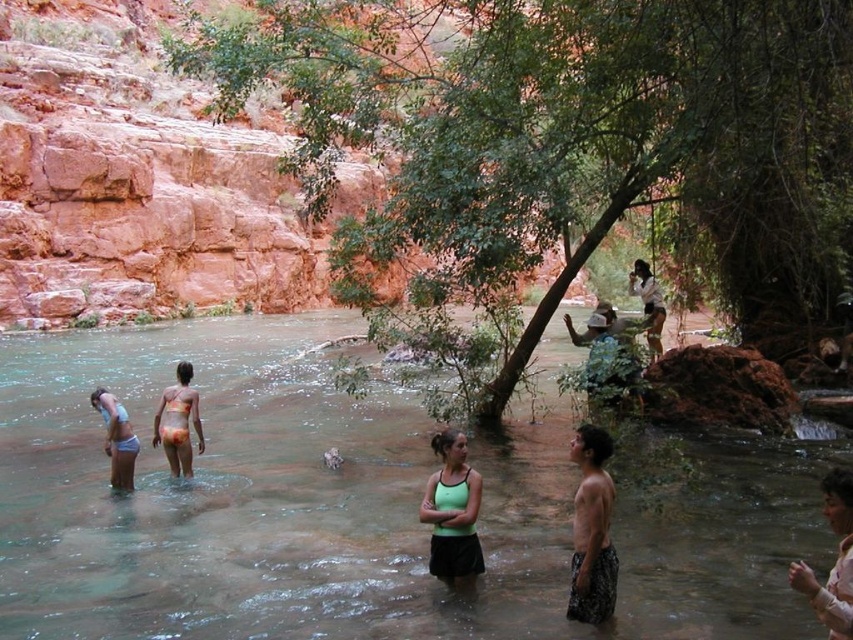
Question: Which point is farther from the camera taking this photo?

Choices:
 (A) [x=599, y=502]
 (B) [x=468, y=529]

Answer: (B)

Question: Which is nearer to the printed fabric bikini at center?

Choices:
 (A) light pink fabric at lower right
 (B) white cotton shirt at upper center
 (C) matte white hat at upper center
 (D) dark brown textured shorts at lower right

Answer: (D)

Question: In this image, where is light pink fabric at lower right located relative to printed fabric bikini at center?

Choices:
 (A) right
 (B) left

Answer: (A)

Question: Considering the relative positions of white cotton shirt at upper center and matte white hat at upper center in the image provided, where is white cotton shirt at upper center located with respect to matte white hat at upper center?

Choices:
 (A) below
 (B) above

Answer: (B)

Question: Considering the real-world distances, which object is farthest from the dark brown textured shorts at lower right?

Choices:
 (A) red rock cliff at upper left
 (B) matte white hat at upper center

Answer: (A)

Question: Observing the image, what is the correct spatial positioning of clear water stream at center in reference to light blue bikini at lower left?

Choices:
 (A) below
 (B) above

Answer: (B)